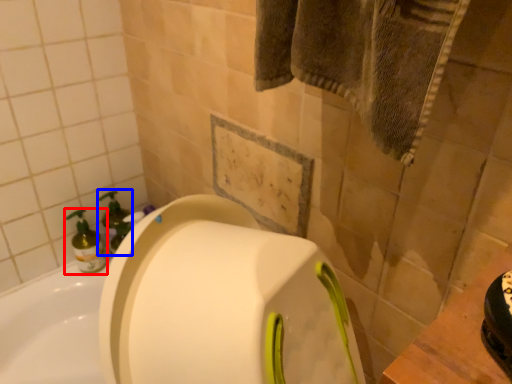
Question: Which object is further to the camera taking this photo, cleaning product (highlighted by a red box) or soap dispenser (highlighted by a blue box)?

Choices:
 (A) cleaning product
 (B) soap dispenser

Answer: (B)